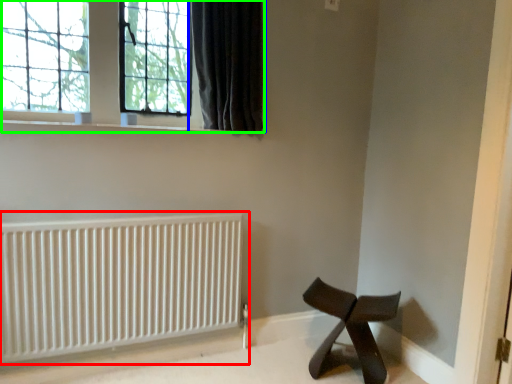
Question: Which object is positioned closest to radiator (highlighted by a red box)? Select from curtain (highlighted by a blue box) and window (highlighted by a green box).

Choices:
 (A) curtain
 (B) window

Answer: (B)